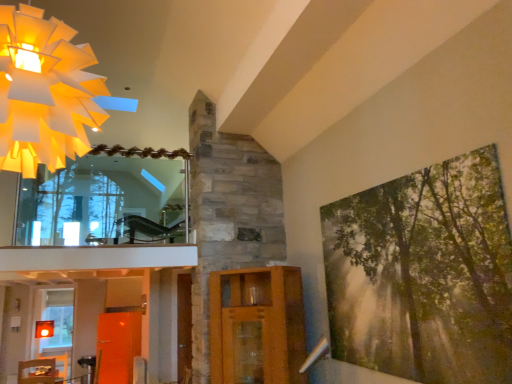
Question: Should I look upward or downward to see wooden cabinet at center?

Choices:
 (A) up
 (B) down

Answer: (B)

Question: Can you see green textured canvas at right touching wooden table at lower left?

Choices:
 (A) yes
 (B) no

Answer: (B)

Question: Is green textured canvas at right behind wooden table at lower left?

Choices:
 (A) no
 (B) yes

Answer: (A)

Question: From the image's perspective, is green textured canvas at right below wooden table at lower left?

Choices:
 (A) yes
 (B) no

Answer: (B)

Question: Is green textured canvas at right facing towards wooden table at lower left?

Choices:
 (A) no
 (B) yes

Answer: (A)

Question: Considering the relative sizes of green textured canvas at right and wooden table at lower left in the image provided, is green textured canvas at right bigger than wooden table at lower left?

Choices:
 (A) no
 (B) yes

Answer: (A)

Question: Would you say wooden table at lower left is part of green textured canvas at right's contents?

Choices:
 (A) yes
 (B) no

Answer: (B)

Question: Is translucent glass window at lower left beside matte paper chandelier at upper left?

Choices:
 (A) no
 (B) yes

Answer: (A)

Question: Can we say translucent glass window at lower left lies outside matte paper chandelier at upper left?

Choices:
 (A) no
 (B) yes

Answer: (B)

Question: Is translucent glass window at lower left at the left side of matte paper chandelier at upper left?

Choices:
 (A) no
 (B) yes

Answer: (B)

Question: Does translucent glass window at lower left come in front of matte paper chandelier at upper left?

Choices:
 (A) no
 (B) yes

Answer: (A)

Question: Considering the relative sizes of translucent glass window at lower left and matte paper chandelier at upper left in the image provided, is translucent glass window at lower left bigger than matte paper chandelier at upper left?

Choices:
 (A) yes
 (B) no

Answer: (B)

Question: Is translucent glass window at lower left thinner than matte paper chandelier at upper left?

Choices:
 (A) yes
 (B) no

Answer: (A)

Question: Considering the relative sizes of green textured canvas at right and translucent glass window at lower left in the image provided, is green textured canvas at right thinner than translucent glass window at lower left?

Choices:
 (A) yes
 (B) no

Answer: (A)